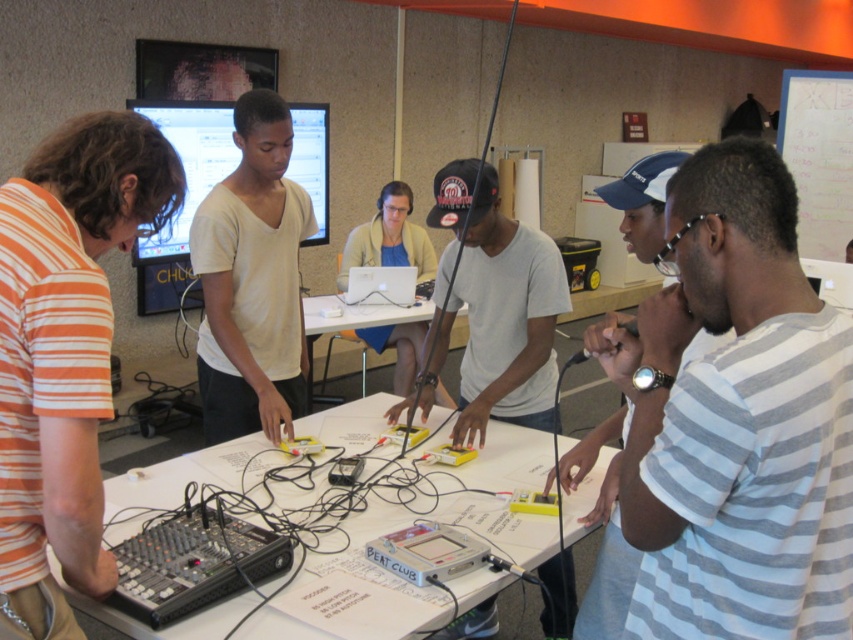
Question: Can you confirm if orange striped shirt at left is wider than light beige sweater at center?

Choices:
 (A) yes
 (B) no

Answer: (B)

Question: Is gray striped shirt at center below orange striped shirt at left?

Choices:
 (A) yes
 (B) no

Answer: (A)

Question: Estimate the real-world distances between objects in this image. Which object is closer to the silver metallic laptop at center?

Choices:
 (A) gray striped shirt at center
 (B) white matte shirt at center
 (C) white paper at center
 (D) light beige sweater at center

Answer: (D)

Question: Among these objects, which one is farthest from the camera?

Choices:
 (A) white matte shirt at center
 (B) gray striped shirt at center

Answer: (A)

Question: Is orange striped shirt at left behind white paper at center?

Choices:
 (A) no
 (B) yes

Answer: (A)

Question: Which point is farther from the camera taking this photo?

Choices:
 (A) (283, 168)
 (B) (473, 579)
 (C) (399, 269)
 (D) (669, 460)

Answer: (C)